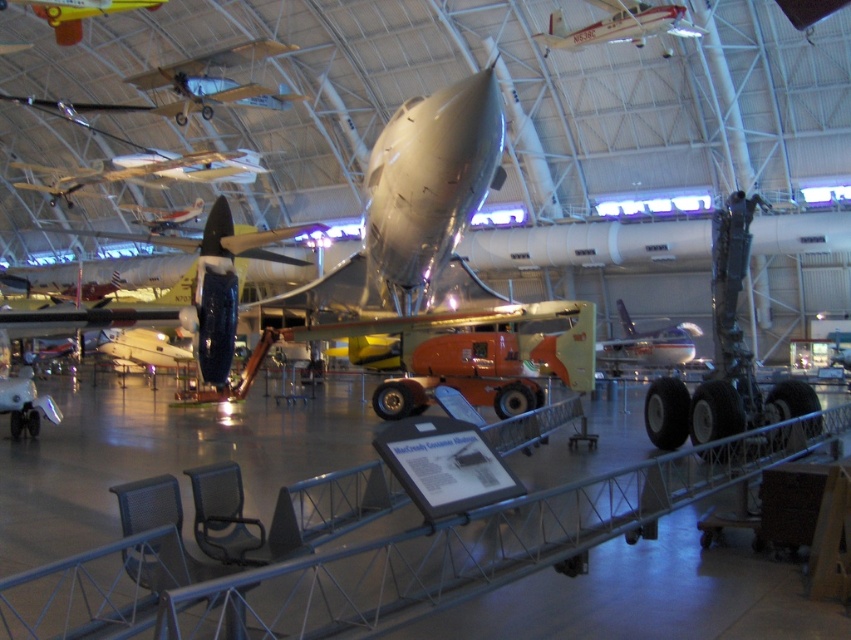
Question: Which object is the closest to the matte orange airplane at center?

Choices:
 (A) silver metallic airplane at upper center
 (B) shiny silver airplane at upper center
 (C) metal/textured rail at center

Answer: (A)

Question: Which point is closer to the camera taking this photo?

Choices:
 (A) (749, 429)
 (B) (77, 16)
 (C) (677, 19)
 (D) (688, 337)

Answer: (A)

Question: From the image, what is the correct spatial relationship of silver metallic airplane at upper center in relation to matte orange airplane at center?

Choices:
 (A) right
 (B) left

Answer: (B)

Question: Is silver metallic airplane at upper center positioned behind yellow matte airplane at upper left?

Choices:
 (A) yes
 (B) no

Answer: (B)

Question: Which object appears closest to the camera in this image?

Choices:
 (A) shiny silver airplane at upper center
 (B) metal/textured rail at center
 (C) matte orange airplane at center
 (D) silver metallic airplane at upper center

Answer: (B)

Question: Is silver metallic airplane at upper center thinner than yellow matte airplane at upper left?

Choices:
 (A) yes
 (B) no

Answer: (B)